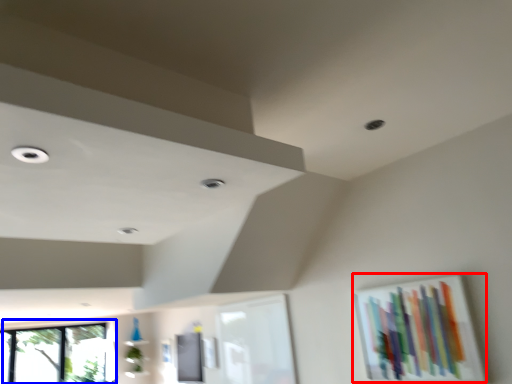
Question: Which of the following is the closest to the observer, picture frame (highlighted by a red box) or window (highlighted by a blue box)?

Choices:
 (A) picture frame
 (B) window

Answer: (A)